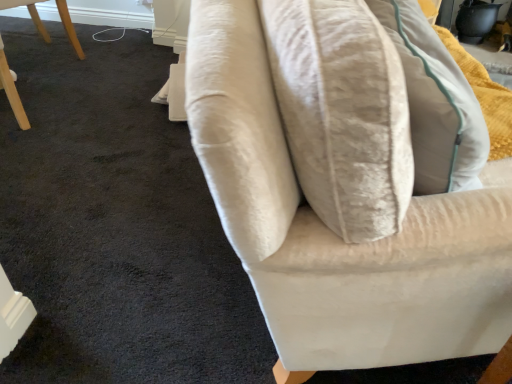
The height and width of the screenshot is (384, 512). Describe the element at coordinates (11, 90) in the screenshot. I see `matte wood chair at lower left` at that location.

Locate an element on the screen. The width and height of the screenshot is (512, 384). matte wood chair at lower left is located at coordinates (11, 90).

Identify the location of velvet beige sofa at center. (328, 228).

The height and width of the screenshot is (384, 512). What do you see at coordinates (328, 228) in the screenshot?
I see `velvet beige sofa at center` at bounding box center [328, 228].

Locate an element on the screen. The height and width of the screenshot is (384, 512). matte wood chair at lower left is located at coordinates (11, 90).

From the picture: Between matte wood chair at lower left and velvet beige sofa at center, which one appears on the left side from the viewer's perspective?

matte wood chair at lower left.

Which object is further away from the camera, matte wood chair at lower left or velvet beige sofa at center?

A: Positioned behind is matte wood chair at lower left.

Which is in front, point (11, 100) or point (473, 234)?

Point (473, 234)

From the image's perspective, does matte wood chair at lower left appear lower than velvet beige sofa at center?

No.

From a real-world perspective, is matte wood chair at lower left positioned above or below velvet beige sofa at center?

From a real-world perspective, matte wood chair at lower left is physically above velvet beige sofa at center.

Which of these two, matte wood chair at lower left or velvet beige sofa at center, is thinner?

matte wood chair at lower left is thinner.

Can you confirm if matte wood chair at lower left is taller than velvet beige sofa at center?

Indeed, matte wood chair at lower left has a greater height compared to velvet beige sofa at center.

Looking at the image, does matte wood chair at lower left seem bigger or smaller compared to velvet beige sofa at center?

matte wood chair at lower left is smaller than velvet beige sofa at center.

Which is correct: matte wood chair at lower left is inside velvet beige sofa at center, or outside of it?

matte wood chair at lower left lies outside velvet beige sofa at center.

Are matte wood chair at lower left and velvet beige sofa at center located far from each other?

Yes, matte wood chair at lower left and velvet beige sofa at center are located far from each other.

Is matte wood chair at lower left turned away from velvet beige sofa at center?

matte wood chair at lower left does not have its back to velvet beige sofa at center.

How many degrees apart are the facing directions of matte wood chair at lower left and velvet beige sofa at center?

The facing directions of matte wood chair at lower left and velvet beige sofa at center are 58.7 degrees apart.

Where is `furniture located on the right of matte wood chair at lower left`? This screenshot has width=512, height=384. furniture located on the right of matte wood chair at lower left is located at coordinates (328, 228).

Can you confirm if velvet beige sofa at center is positioned to the right of matte wood chair at lower left?

Indeed, velvet beige sofa at center is positioned on the right side of matte wood chair at lower left.

Is the depth of velvet beige sofa at center less than that of matte wood chair at lower left?

Yes, velvet beige sofa at center is in front of matte wood chair at lower left.

Which is farther, (307, 279) or (0, 89)?

Point (0, 89)

From the image's perspective, does velvet beige sofa at center appear higher than matte wood chair at lower left?

No.

From a real-world perspective, is velvet beige sofa at center over matte wood chair at lower left?

No.

Between velvet beige sofa at center and matte wood chair at lower left, which one has smaller width?

With smaller width is matte wood chair at lower left.

Who is taller, velvet beige sofa at center or matte wood chair at lower left?

matte wood chair at lower left.

Is velvet beige sofa at center bigger than matte wood chair at lower left?

Yes.

Is matte wood chair at lower left surrounded by velvet beige sofa at center?

Definitely not — matte wood chair at lower left is not inside velvet beige sofa at center.

Is velvet beige sofa at center far away from matte wood chair at lower left?

Absolutely, velvet beige sofa at center is distant from matte wood chair at lower left.

Is velvet beige sofa at center facing towards matte wood chair at lower left?

No, velvet beige sofa at center is not turned towards matte wood chair at lower left.

What's the angular difference between velvet beige sofa at center and matte wood chair at lower left's facing directions?

The angular difference between velvet beige sofa at center and matte wood chair at lower left is 58.7 degrees.

Where is `furniture in front of the matte wood chair at lower left`? The image size is (512, 384). furniture in front of the matte wood chair at lower left is located at coordinates (x=328, y=228).

At what (x,y) coordinates should I click in order to perform the action: click on chair that is behind the velvet beige sofa at center. Please return your answer as a coordinate pair (x, y). The image size is (512, 384). Looking at the image, I should click on (11, 90).

This screenshot has height=384, width=512. I want to click on furniture in front of the matte wood chair at lower left, so click(x=328, y=228).